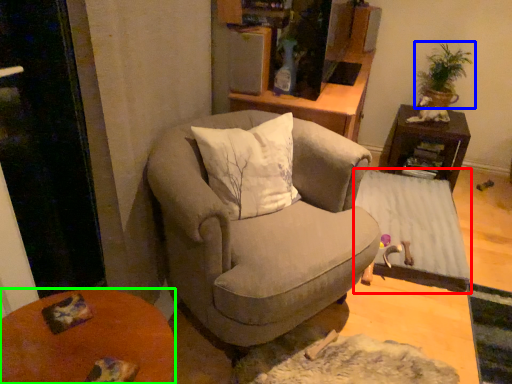
Question: Which is farther away from table (highlighted by a red box)? houseplant (highlighted by a blue box) or desk (highlighted by a green box)?

Choices:
 (A) houseplant
 (B) desk

Answer: (B)